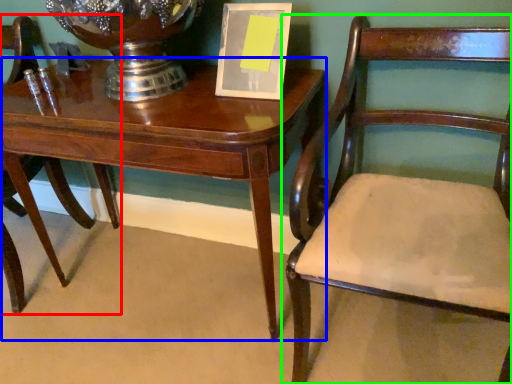
Question: Considering the real-world distances, which object is closest to chair (highlighted by a red box)? table (highlighted by a blue box) or chair (highlighted by a green box).

Choices:
 (A) table
 (B) chair

Answer: (A)